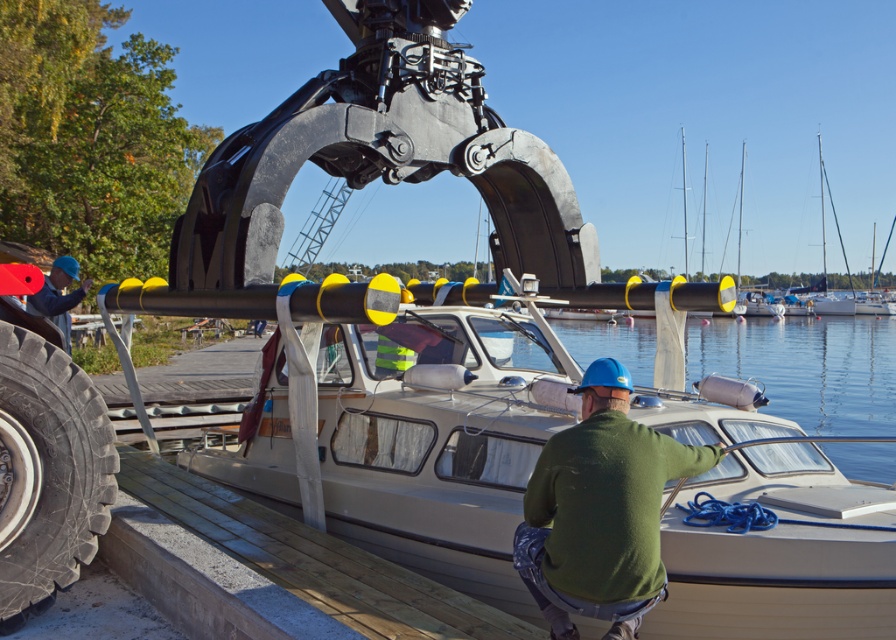
Between point (55, 513) and point (875, 428), which one is positioned in front?

Point (55, 513) is more forward.

Is black rubber tire at lower left wider than clear water at boat right?

In fact, black rubber tire at lower left might be narrower than clear water at boat right.

What do you see at coordinates (47, 472) in the screenshot? This screenshot has width=896, height=640. I see `black rubber tire at lower left` at bounding box center [47, 472].

Identify the location of black rubber tire at lower left. The height and width of the screenshot is (640, 896). (47, 472).

Can you confirm if green matte shirt at center is positioned to the right of clear water at boat right?

In fact, green matte shirt at center is to the left of clear water at boat right.

Is point (634, 433) positioned in front of point (877, 387)?

That is True.

At what (x,y) coordinates should I click in order to perform the action: click on green matte shirt at center. Please return your answer as a coordinate pair (x, y). Looking at the image, I should click on (600, 509).

Does white plastic boat at center come behind green matte shirt at center?

That is True.

This screenshot has height=640, width=896. Find the location of `white plastic boat at center`. white plastic boat at center is located at coordinates (562, 476).